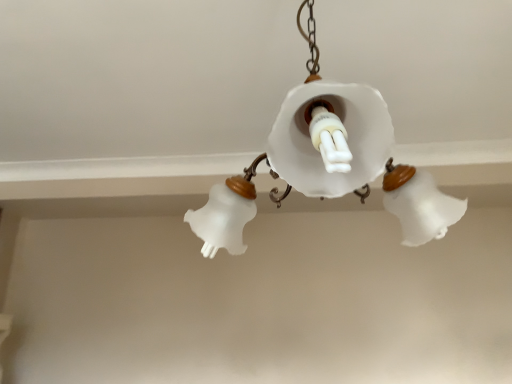
At what (x,y) coordinates should I click in order to perform the action: click on white frosted glass chandelier at center. Please return your answer as a coordinate pair (x, y). Image resolution: width=512 pixels, height=384 pixels. Looking at the image, I should click on (328, 162).

Describe the element at coordinates (328, 162) in the screenshot. I see `white frosted glass chandelier at center` at that location.

You are a GUI agent. You are given a task and a screenshot of the screen. Output one action in this format:
    pyautogui.click(x=<x>, y=<y>)
    Task: Click on the white frosted glass chandelier at center
    The image size is (512, 384).
    Given the screenshot: What is the action you would take?
    click(328, 162)